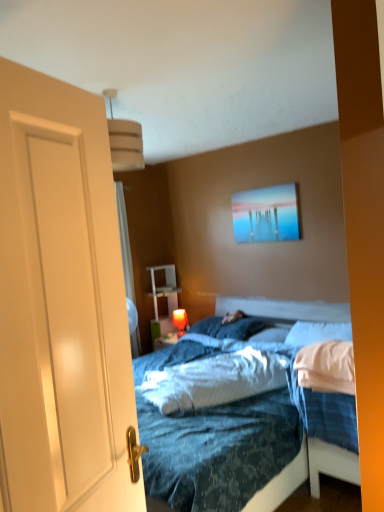
Question: Would you say blue textured mattress at center is a long distance from blue soft pillow at center, positioned as the 2th pillow in left-to-right order?

Choices:
 (A) yes
 (B) no

Answer: (B)

Question: Considering the relative positions of blue textured mattress at center and blue soft pillow at center, placed as the 2th pillow when sorted from right to left, in the image provided, is blue textured mattress at center to the left of blue soft pillow at center, placed as the 2th pillow when sorted from right to left, from the viewer's perspective?

Choices:
 (A) yes
 (B) no

Answer: (A)

Question: From a real-world perspective, is blue textured mattress at center over blue soft pillow at center, placed as the 2th pillow when sorted from right to left?

Choices:
 (A) yes
 (B) no

Answer: (A)

Question: Does blue textured mattress at center have a larger size compared to blue soft pillow at center, placed as the 2th pillow when sorted from right to left?

Choices:
 (A) yes
 (B) no

Answer: (A)

Question: From the image's perspective, is blue textured mattress at center on top of blue soft pillow at center, placed as the 2th pillow when sorted from right to left?

Choices:
 (A) yes
 (B) no

Answer: (B)

Question: Considering the relative sizes of blue textured mattress at center and blue soft pillow at center, placed as the 2th pillow when sorted from right to left, in the image provided, is blue textured mattress at center taller than blue soft pillow at center, placed as the 2th pillow when sorted from right to left,?

Choices:
 (A) no
 (B) yes

Answer: (B)

Question: Does matte orange lampshade at center lie behind white soft pillow at right, the 1th pillow positioned from the right?

Choices:
 (A) no
 (B) yes

Answer: (B)

Question: Would you say white soft pillow at right, the 1th pillow positioned from the right, is part of matte orange lampshade at center's contents?

Choices:
 (A) yes
 (B) no

Answer: (B)

Question: From a real-world perspective, is matte orange lampshade at center located beneath white soft pillow at right, the 1th pillow positioned from the right?

Choices:
 (A) no
 (B) yes

Answer: (B)

Question: Considering the relative positions of matte orange lampshade at center and white soft pillow at right, the 1th pillow positioned from the right, in the image provided, is matte orange lampshade at center to the left of white soft pillow at right, the 1th pillow positioned from the right, from the viewer's perspective?

Choices:
 (A) yes
 (B) no

Answer: (A)

Question: Could you tell me if matte orange lampshade at center is facing white soft pillow at right, the 1th pillow positioned from the right?

Choices:
 (A) yes
 (B) no

Answer: (B)

Question: Does matte orange lampshade at center appear on the right side of white soft pillow at right, which is the third pillow in left-to-right order?

Choices:
 (A) no
 (B) yes

Answer: (A)

Question: Can you confirm if matte orange lampshade at center is wider than blue soft pillow at center, placed as the 2th pillow when sorted from right to left?

Choices:
 (A) no
 (B) yes

Answer: (A)